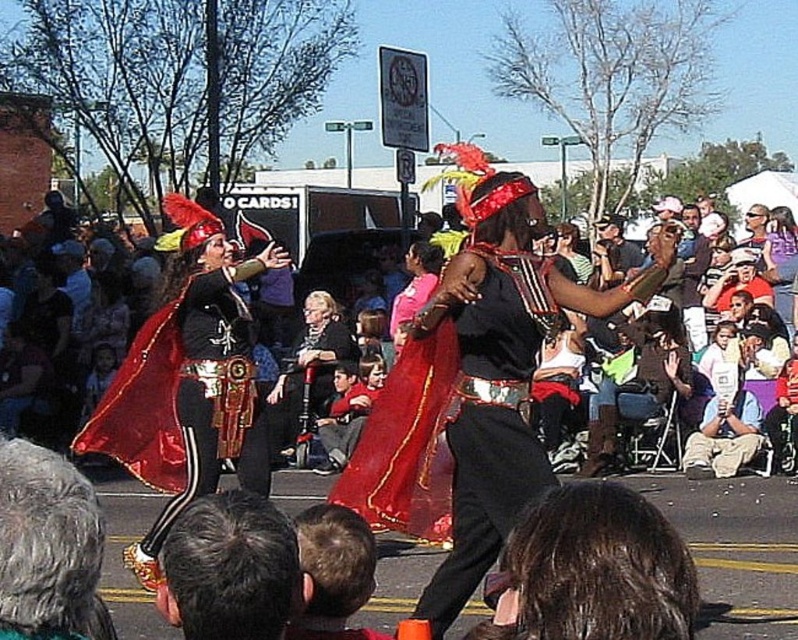
You are a photographer trying to capture a photo of the shiny black dress at center and the gray hair at lower center. Which object is wider in the image?

The shiny black dress at center is wider than the gray hair at lower center.

You are a photographer trying to capture the perfect shot of the shiny black dress at center during the performance. Based on its position, where should you aim your camera to ensure the dress is in the frame?

The shiny black dress at center is located at coordinates point (x=488, y=442), so aim your camera at that point to capture it in the frame.

You are a photographer trying to capture a clear shot of the shiny black dress at center and the gray hair at lower center. Which object should you focus on first if you want to ensure both are in focus without adjusting the camera settings?

The shiny black dress at center is taller than gray hair at lower center. To keep both in focus, you should focus on the shiny black dress at center first since it is farther away, allowing the gray hair at lower center to fall within the depth of field.